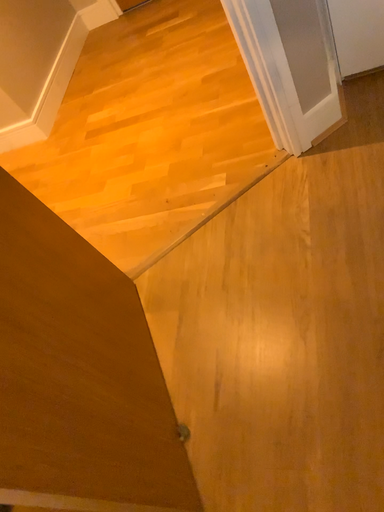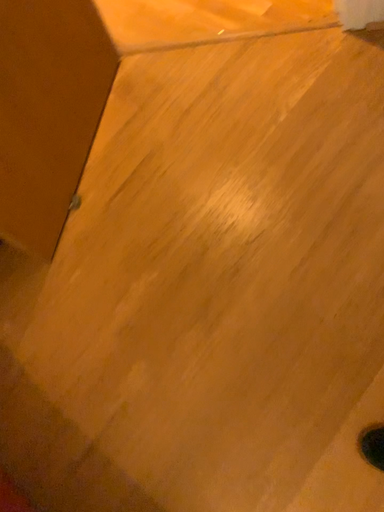
Question: How did the camera likely rotate when shooting the video?

Choices:
 (A) rotated downward
 (B) rotated upward

Answer: (A)